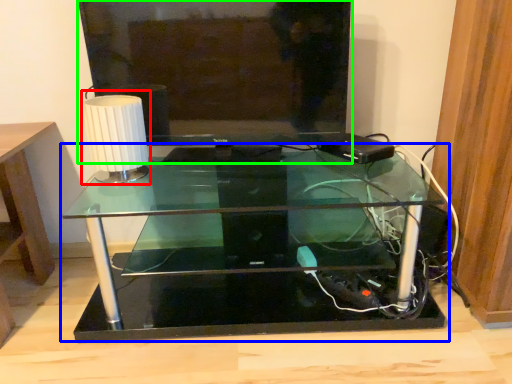
Question: Considering the real-world distances, which object is farthest from table lamp (highlighted by a red box)? table (highlighted by a blue box) or television (highlighted by a green box)?

Choices:
 (A) table
 (B) television

Answer: (A)